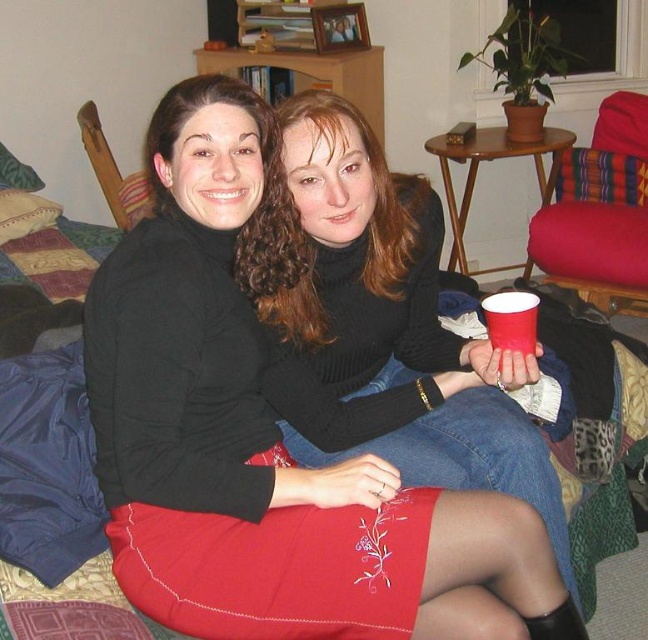
You are a fashion designer observing the image. You need to determine which item of clothing is positioned higher on the person wearing them. Which one is higher between the matte black sweater at center and the embroidered satin skirt at lower center?

The matte black sweater at center is much taller as embroidered satin skirt at lower center, so the matte black sweater at center is positioned higher on the person wearing them.

You are a fashion designer observing the two individuals in the image. You need to determine the vertical arrangement of their clothing items. Which clothing item is positioned higher on the person wearing both the black turtleneck sweater at center and the embroidered satin skirt at lower center?

The black turtleneck sweater at center is located above the embroidered satin skirt at lower center, so the sweater is positioned higher on the person.

You are a photographer trying to capture a clear shot of the embroidered satin skirt at lower center and the red paper cup at lower right. Which object will appear larger in the photo?

The embroidered satin skirt at lower center will appear larger in the photo because it is closer to the viewer than the red paper cup at lower right.